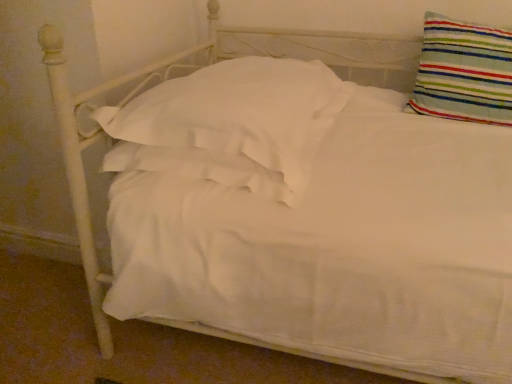
In order to face striped fabric pillow at upper right, acting as the 2th pillow starting from the left, should I rotate leftwards or rightwards?

Turn right approximately 26.780 degrees to face it.

The width and height of the screenshot is (512, 384). I want to click on striped fabric pillow at upper right, the first pillow viewed from the right, so click(464, 72).

What do you see at coordinates (464, 72) in the screenshot? The height and width of the screenshot is (384, 512). I see `striped fabric pillow at upper right, acting as the 2th pillow starting from the left` at bounding box center [464, 72].

What is the approximate height of striped fabric pillow at upper right, the first pillow viewed from the right?

13.07 inches.

The width and height of the screenshot is (512, 384). Describe the element at coordinates (231, 125) in the screenshot. I see `white soft pillow at center, the 1th pillow when ordered from left to right` at that location.

Where is `white soft pillow at center, the 1th pillow when ordered from left to right`? Image resolution: width=512 pixels, height=384 pixels. white soft pillow at center, the 1th pillow when ordered from left to right is located at coordinates (x=231, y=125).

The image size is (512, 384). Find the location of `striped fabric pillow at upper right, the first pillow viewed from the right`. striped fabric pillow at upper right, the first pillow viewed from the right is located at coordinates (464, 72).

Which object is positioned more to the right, striped fabric pillow at upper right, the first pillow viewed from the right, or white soft pillow at center, marked as the 2th pillow in a right-to-left arrangement?

Positioned to the right is striped fabric pillow at upper right, the first pillow viewed from the right.

Which is behind, striped fabric pillow at upper right, the first pillow viewed from the right, or white soft pillow at center, marked as the 2th pillow in a right-to-left arrangement?

striped fabric pillow at upper right, the first pillow viewed from the right.

Consider the image. Which point is more forward, [457,110] or [271,157]?

Positioned in front is point [271,157].

From the image's perspective, is striped fabric pillow at upper right, acting as the 2th pillow starting from the left, located beneath white soft pillow at center, the 1th pillow when ordered from left to right?

No.

From a real-world perspective, which is physically above, striped fabric pillow at upper right, acting as the 2th pillow starting from the left, or white soft pillow at center, marked as the 2th pillow in a right-to-left arrangement?

From a 3D spatial view, striped fabric pillow at upper right, acting as the 2th pillow starting from the left, is above.

From the picture: Between striped fabric pillow at upper right, the first pillow viewed from the right, and white soft pillow at center, the 1th pillow when ordered from left to right, which one has smaller width?

With smaller width is striped fabric pillow at upper right, the first pillow viewed from the right.

Who is taller, striped fabric pillow at upper right, acting as the 2th pillow starting from the left, or white soft pillow at center, marked as the 2th pillow in a right-to-left arrangement?

striped fabric pillow at upper right, acting as the 2th pillow starting from the left.

Considering the sizes of objects striped fabric pillow at upper right, acting as the 2th pillow starting from the left, and white soft pillow at center, marked as the 2th pillow in a right-to-left arrangement, in the image provided, who is smaller, striped fabric pillow at upper right, acting as the 2th pillow starting from the left, or white soft pillow at center, marked as the 2th pillow in a right-to-left arrangement,?

striped fabric pillow at upper right, acting as the 2th pillow starting from the left.

Is striped fabric pillow at upper right, the first pillow viewed from the right, situated inside white soft pillow at center, marked as the 2th pillow in a right-to-left arrangement, or outside?

striped fabric pillow at upper right, the first pillow viewed from the right, lies outside white soft pillow at center, marked as the 2th pillow in a right-to-left arrangement.

Would you say striped fabric pillow at upper right, the first pillow viewed from the right, is a long distance from white soft pillow at center, marked as the 2th pillow in a right-to-left arrangement?

No, there isn't a large distance between striped fabric pillow at upper right, the first pillow viewed from the right, and white soft pillow at center, marked as the 2th pillow in a right-to-left arrangement.

From the picture: Could you tell me if striped fabric pillow at upper right, the first pillow viewed from the right, is turned towards white soft pillow at center, the 1th pillow when ordered from left to right?

No, striped fabric pillow at upper right, the first pillow viewed from the right, does not turn towards white soft pillow at center, the 1th pillow when ordered from left to right.

I want to click on pillow lying on the left of striped fabric pillow at upper right, acting as the 2th pillow starting from the left, so click(x=231, y=125).

Considering the relative positions of white soft pillow at center, the 1th pillow when ordered from left to right, and striped fabric pillow at upper right, the first pillow viewed from the right, in the image provided, is white soft pillow at center, the 1th pillow when ordered from left to right, to the right of striped fabric pillow at upper right, the first pillow viewed from the right, from the viewer's perspective?

No.

Does white soft pillow at center, marked as the 2th pillow in a right-to-left arrangement, lie behind striped fabric pillow at upper right, acting as the 2th pillow starting from the left?

No, the depth of white soft pillow at center, marked as the 2th pillow in a right-to-left arrangement, is less than that of striped fabric pillow at upper right, acting as the 2th pillow starting from the left.

Which is closer, (x=215, y=166) or (x=496, y=111)?

Point (x=215, y=166).

From the image's perspective, which one is positioned higher, white soft pillow at center, the 1th pillow when ordered from left to right, or striped fabric pillow at upper right, the first pillow viewed from the right?

striped fabric pillow at upper right, the first pillow viewed from the right, appears higher in the image.

Based on the photo, from a real-world perspective, which object stands above the other?

In real-world perspective, striped fabric pillow at upper right, acting as the 2th pillow starting from the left, is above.

Between white soft pillow at center, the 1th pillow when ordered from left to right, and striped fabric pillow at upper right, the first pillow viewed from the right, which one has larger width?

With larger width is white soft pillow at center, the 1th pillow when ordered from left to right.

Who is taller, white soft pillow at center, marked as the 2th pillow in a right-to-left arrangement, or striped fabric pillow at upper right, acting as the 2th pillow starting from the left?

striped fabric pillow at upper right, acting as the 2th pillow starting from the left, is taller.

Considering the sizes of objects white soft pillow at center, the 1th pillow when ordered from left to right, and striped fabric pillow at upper right, acting as the 2th pillow starting from the left, in the image provided, who is bigger, white soft pillow at center, the 1th pillow when ordered from left to right, or striped fabric pillow at upper right, acting as the 2th pillow starting from the left,?

white soft pillow at center, the 1th pillow when ordered from left to right.

Is white soft pillow at center, the 1th pillow when ordered from left to right, inside the boundaries of striped fabric pillow at upper right, the first pillow viewed from the right, or outside?

white soft pillow at center, the 1th pillow when ordered from left to right, is not enclosed by striped fabric pillow at upper right, the first pillow viewed from the right.

Is white soft pillow at center, the 1th pillow when ordered from left to right, far from striped fabric pillow at upper right, the first pillow viewed from the right?

They are positioned close to each other.

Is white soft pillow at center, marked as the 2th pillow in a right-to-left arrangement, oriented towards striped fabric pillow at upper right, the first pillow viewed from the right?

No.

How different are the orientations of white soft pillow at center, the 1th pillow when ordered from left to right, and striped fabric pillow at upper right, the first pillow viewed from the right, in degrees?

2.56 degrees.

Measure the distance from white soft pillow at center, marked as the 2th pillow in a right-to-left arrangement, to striped fabric pillow at upper right, acting as the 2th pillow starting from the left.

A distance of 21.21 inches exists between white soft pillow at center, marked as the 2th pillow in a right-to-left arrangement, and striped fabric pillow at upper right, acting as the 2th pillow starting from the left.

Where is `pillow directly beneath the striped fabric pillow at upper right, acting as the 2th pillow starting from the left (from a real-world perspective)`? The height and width of the screenshot is (384, 512). pillow directly beneath the striped fabric pillow at upper right, acting as the 2th pillow starting from the left (from a real-world perspective) is located at coordinates (231, 125).

You are a GUI agent. You are given a task and a screenshot of the screen. Output one action in this format:
    pyautogui.click(x=<x>, y=<y>)
    Task: Click on the pillow behind the white soft pillow at center, marked as the 2th pillow in a right-to-left arrangement
    
    Given the screenshot: What is the action you would take?
    pyautogui.click(x=464, y=72)

This screenshot has height=384, width=512. I want to click on pillow on the left of striped fabric pillow at upper right, acting as the 2th pillow starting from the left, so click(x=231, y=125).